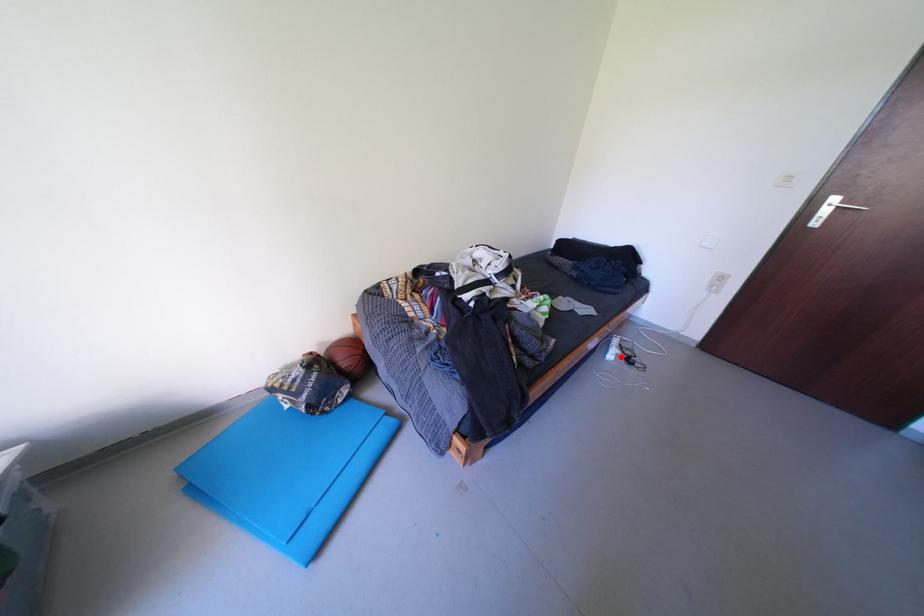
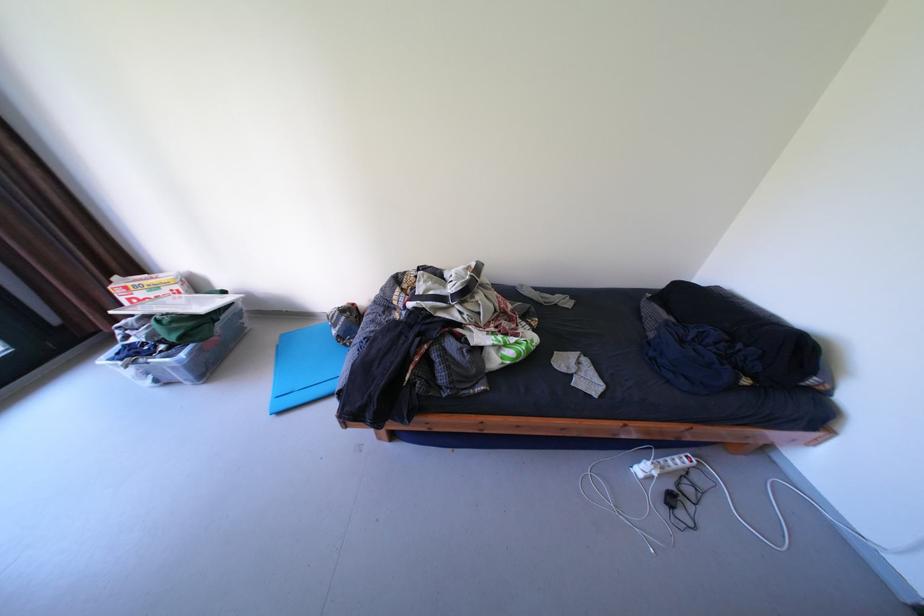
Find the pixel in the second image that matches the highlighted location in the first image.

(649, 471)